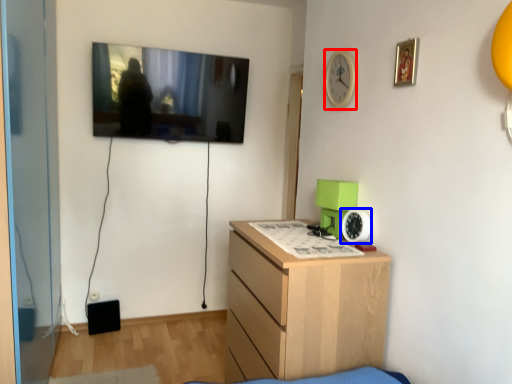
Question: Among these objects, which one is farthest to the camera, clock (highlighted by a red box) or clock (highlighted by a blue box)?

Choices:
 (A) clock
 (B) clock

Answer: (A)